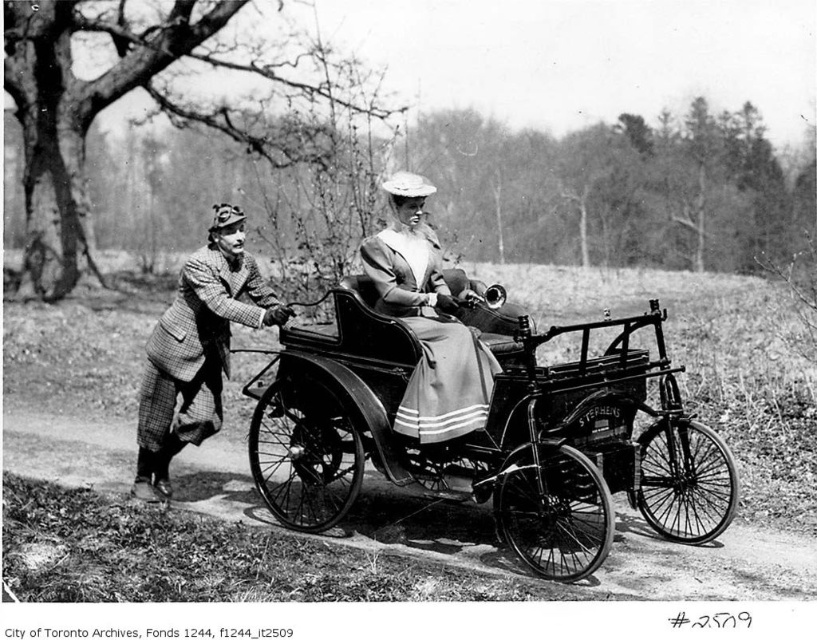
You are a photographer in the early 20th century trying to capture a portrait of the metallic black wagon at center and the plaid wool coat at left. Since you have a limited amount of film, you want to ensure that both subjects are in frame. Given that your camera has a fixed focal length, which subject should you position closer to the camera to ensure both fit in the frame?

The metallic black wagon at center is bigger than the plaid wool coat at left. To ensure both fit in the frame, position the plaid wool coat at left closer to the camera since it is smaller and requires less space, allowing the larger wagon to be placed further back while still capturing both within the frame.

You are a tailor observing two coats in an old photograph. You need to determine which coat is taller. The coats are the plaid wool coat at left and the matte gray coat at center. Based on their positions, can you tell which one is taller?

The plaid wool coat at left has a greater height compared to the matte gray coat at center, so the plaid wool coat at left is taller.